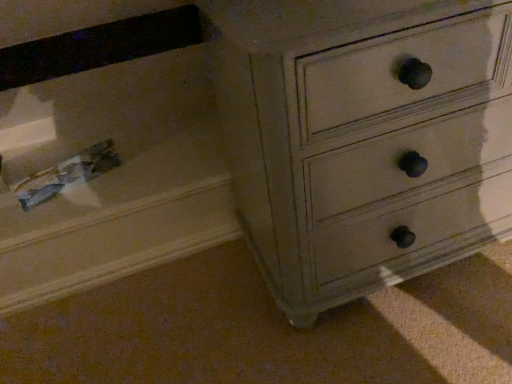
I want to click on matte white drawer at center, which is the 1th drawer in right-to-left order, so click(401, 147).

Describe the element at coordinates (401, 147) in the screenshot. I see `matte white drawer at center, the 2th drawer from the left` at that location.

What do you see at coordinates (105, 148) in the screenshot? I see `clear plastic drawer at lower left, the first drawer when ordered from left to right` at bounding box center [105, 148].

Where is `clear plastic drawer at lower left, marked as the second drawer in a right-to-left arrangement`? This screenshot has width=512, height=384. clear plastic drawer at lower left, marked as the second drawer in a right-to-left arrangement is located at coordinates 105,148.

Measure the distance between point (x=186, y=23) and camera.

Point (x=186, y=23) and camera are 38.82 inches apart from each other.

Locate an element on the screen. matte white drawer at center, which is the 1th drawer in right-to-left order is located at coordinates (401, 147).

Does matte white drawer at center, which is the 1th drawer in right-to-left order, appear on the left side of clear plastic drawer at lower left, marked as the second drawer in a right-to-left arrangement?

No.

Considering the relative positions of matte white drawer at center, the 2th drawer from the left, and clear plastic drawer at lower left, marked as the second drawer in a right-to-left arrangement, in the image provided, is matte white drawer at center, the 2th drawer from the left, behind clear plastic drawer at lower left, marked as the second drawer in a right-to-left arrangement,?

No, it is not.

Which is more distant, (x=461, y=248) or (x=128, y=210)?

The point (x=128, y=210) is behind.

From the image's perspective, would you say matte white drawer at center, which is the 1th drawer in right-to-left order, is shown under clear plastic drawer at lower left, the first drawer when ordered from left to right?

Incorrect, from the image's perspective, matte white drawer at center, which is the 1th drawer in right-to-left order, is higher than clear plastic drawer at lower left, the first drawer when ordered from left to right.

From a real-world perspective, is matte white drawer at center, which is the 1th drawer in right-to-left order, physically located above or below clear plastic drawer at lower left, the first drawer when ordered from left to right?

In terms of real-world spatial position, matte white drawer at center, which is the 1th drawer in right-to-left order, is above clear plastic drawer at lower left, the first drawer when ordered from left to right.

In terms of width, does matte white drawer at center, the 2th drawer from the left, look wider or thinner when compared to clear plastic drawer at lower left, the first drawer when ordered from left to right?

In the image, matte white drawer at center, the 2th drawer from the left, appears to be more narrow than clear plastic drawer at lower left, the first drawer when ordered from left to right.

Who is taller, matte white drawer at center, the 2th drawer from the left, or clear plastic drawer at lower left, the first drawer when ordered from left to right?

matte white drawer at center, the 2th drawer from the left.

Consider the image. Considering the relative sizes of matte white drawer at center, which is the 1th drawer in right-to-left order, and clear plastic drawer at lower left, marked as the second drawer in a right-to-left arrangement, in the image provided, is matte white drawer at center, which is the 1th drawer in right-to-left order, smaller than clear plastic drawer at lower left, marked as the second drawer in a right-to-left arrangement,?

Incorrect, matte white drawer at center, which is the 1th drawer in right-to-left order, is not smaller in size than clear plastic drawer at lower left, marked as the second drawer in a right-to-left arrangement.

Would you say matte white drawer at center, the 2th drawer from the left, is outside clear plastic drawer at lower left, marked as the second drawer in a right-to-left arrangement?

Yes.

Is matte white drawer at center, which is the 1th drawer in right-to-left order, beside clear plastic drawer at lower left, the first drawer when ordered from left to right?

matte white drawer at center, which is the 1th drawer in right-to-left order, is not next to clear plastic drawer at lower left, the first drawer when ordered from left to right, and they're not touching.

Is matte white drawer at center, the 2th drawer from the left, looking in the opposite direction of clear plastic drawer at lower left, the first drawer when ordered from left to right?

No, matte white drawer at center, the 2th drawer from the left, is not facing away from clear plastic drawer at lower left, the first drawer when ordered from left to right.

This screenshot has width=512, height=384. I want to click on drawer on the left side of matte white drawer at center, which is the 1th drawer in right-to-left order, so click(x=105, y=148).

Visually, is clear plastic drawer at lower left, the first drawer when ordered from left to right, positioned to the left or to the right of matte white drawer at center, which is the 1th drawer in right-to-left order?

In the image, clear plastic drawer at lower left, the first drawer when ordered from left to right, appears on the left side of matte white drawer at center, which is the 1th drawer in right-to-left order.

Considering the positions of objects clear plastic drawer at lower left, the first drawer when ordered from left to right, and matte white drawer at center, which is the 1th drawer in right-to-left order, in the image provided, who is behind, clear plastic drawer at lower left, the first drawer when ordered from left to right, or matte white drawer at center, which is the 1th drawer in right-to-left order,?

Positioned behind is clear plastic drawer at lower left, the first drawer when ordered from left to right.

Between point (195, 154) and point (480, 176), which one is positioned behind?

Point (195, 154)

From the image's perspective, which object appears higher, clear plastic drawer at lower left, the first drawer when ordered from left to right, or matte white drawer at center, which is the 1th drawer in right-to-left order?

matte white drawer at center, which is the 1th drawer in right-to-left order.

From a real-world perspective, is clear plastic drawer at lower left, the first drawer when ordered from left to right, below matte white drawer at center, the 2th drawer from the left?

Yes, from a real-world perspective, clear plastic drawer at lower left, the first drawer when ordered from left to right, is beneath matte white drawer at center, the 2th drawer from the left.

Is clear plastic drawer at lower left, marked as the second drawer in a right-to-left arrangement, thinner than matte white drawer at center, the 2th drawer from the left?

Incorrect, the width of clear plastic drawer at lower left, marked as the second drawer in a right-to-left arrangement, is not less than that of matte white drawer at center, the 2th drawer from the left.

Between clear plastic drawer at lower left, marked as the second drawer in a right-to-left arrangement, and matte white drawer at center, which is the 1th drawer in right-to-left order, which one has less height?

With less height is clear plastic drawer at lower left, marked as the second drawer in a right-to-left arrangement.

Who is smaller, clear plastic drawer at lower left, marked as the second drawer in a right-to-left arrangement, or matte white drawer at center, the 2th drawer from the left?

With smaller size is clear plastic drawer at lower left, marked as the second drawer in a right-to-left arrangement.

Is clear plastic drawer at lower left, marked as the second drawer in a right-to-left arrangement, positioned beyond the bounds of matte white drawer at center, which is the 1th drawer in right-to-left order?

Yes, clear plastic drawer at lower left, marked as the second drawer in a right-to-left arrangement, is outside of matte white drawer at center, which is the 1th drawer in right-to-left order.

Is clear plastic drawer at lower left, marked as the second drawer in a right-to-left arrangement, not close to matte white drawer at center, which is the 1th drawer in right-to-left order?

clear plastic drawer at lower left, marked as the second drawer in a right-to-left arrangement, is actually quite close to matte white drawer at center, which is the 1th drawer in right-to-left order.

Is clear plastic drawer at lower left, the first drawer when ordered from left to right, aimed at matte white drawer at center, the 2th drawer from the left?

No, clear plastic drawer at lower left, the first drawer when ordered from left to right, does not turn towards matte white drawer at center, the 2th drawer from the left.

How different are the orientations of clear plastic drawer at lower left, marked as the second drawer in a right-to-left arrangement, and matte white drawer at center, the 2th drawer from the left, in degrees?

The facing directions of clear plastic drawer at lower left, marked as the second drawer in a right-to-left arrangement, and matte white drawer at center, the 2th drawer from the left, are 1.11 degrees apart.

This screenshot has width=512, height=384. What are the coordinates of `drawer that is above the clear plastic drawer at lower left, the first drawer when ordered from left to right (from a real-world perspective)` in the screenshot? It's located at (401, 147).

The width and height of the screenshot is (512, 384). In order to click on drawer that appears above the clear plastic drawer at lower left, the first drawer when ordered from left to right (from a real-world perspective) in this screenshot , I will do `click(401, 147)`.

Locate an element on the screen. The height and width of the screenshot is (384, 512). drawer that is below the matte white drawer at center, which is the 1th drawer in right-to-left order (from the image's perspective) is located at coordinates (105, 148).